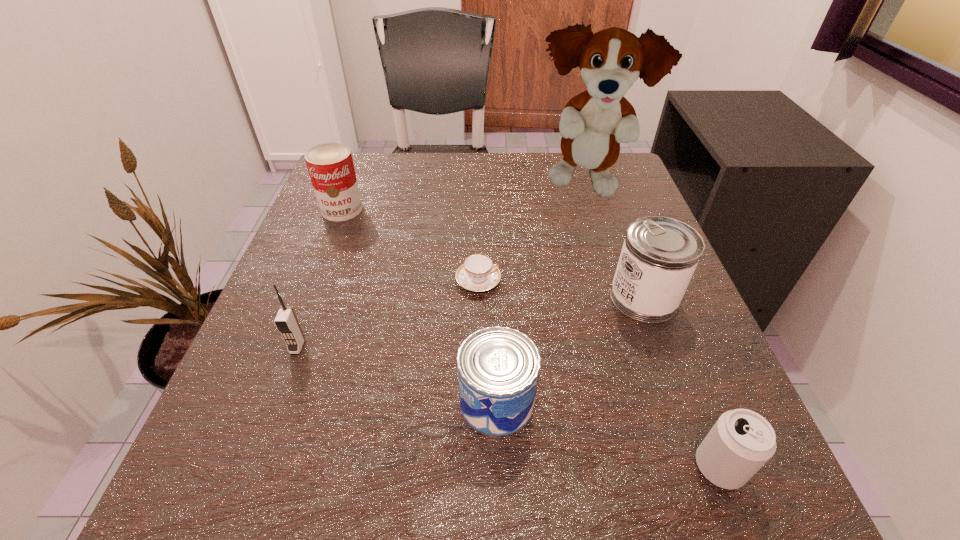
The width and height of the screenshot is (960, 540). Find the location of `free area in between the farthest can and the nearest can`. free area in between the farthest can and the nearest can is located at coordinates (531, 338).

Find the location of `vacant point located between the fifth farthest object and the shortest object`. vacant point located between the fifth farthest object and the shortest object is located at coordinates (388, 314).

The width and height of the screenshot is (960, 540). I want to click on object that ranks as the sixth closest to the farthest can, so click(x=741, y=441).

Identify which object is located as the nearest to the leftmost can. Please provide its 2D coordinates. Your answer should be formatted as a tuple, i.e. [(x, y)], where the tuple contains the x and y coordinates of a point satisfying the conditions above.

[(478, 273)]

Locate which can ranks third in proximity to the tallest object. Please provide its 2D coordinates. Your answer should be formatted as a tuple, i.e. [(x, y)], where the tuple contains the x and y coordinates of a point satisfying the conditions above.

[(498, 367)]

You are a GUI agent. You are given a task and a screenshot of the screen. Output one action in this format:
    pyautogui.click(x=<x>, y=<y>)
    Task: Click on the can object that ranks as the closest to the second nearest object
    The width and height of the screenshot is (960, 540).
    Given the screenshot: What is the action you would take?
    pyautogui.click(x=659, y=256)

You are a GUI agent. You are given a task and a screenshot of the screen. Output one action in this format:
    pyautogui.click(x=<x>, y=<y>)
    Task: Click on the free region that satisfies the following two spatial constraints: 1. on the face of the tallest object; 2. on the left side of the third nearest can
    
    Given the screenshot: What is the action you would take?
    pyautogui.click(x=619, y=298)

You are a GUI agent. You are given a task and a screenshot of the screen. Output one action in this format:
    pyautogui.click(x=<x>, y=<y>)
    Task: Click on the free point that satisfies the following two spatial constraints: 1. on the front label of the second nearest object; 2. on the right side of the nearest can
    The width and height of the screenshot is (960, 540).
    Given the screenshot: What is the action you would take?
    pyautogui.click(x=499, y=467)

I want to click on vacant space that satisfies the following two spatial constraints: 1. on the front label of the second can from left to right; 2. on the right side of the nearest object, so [499, 467].